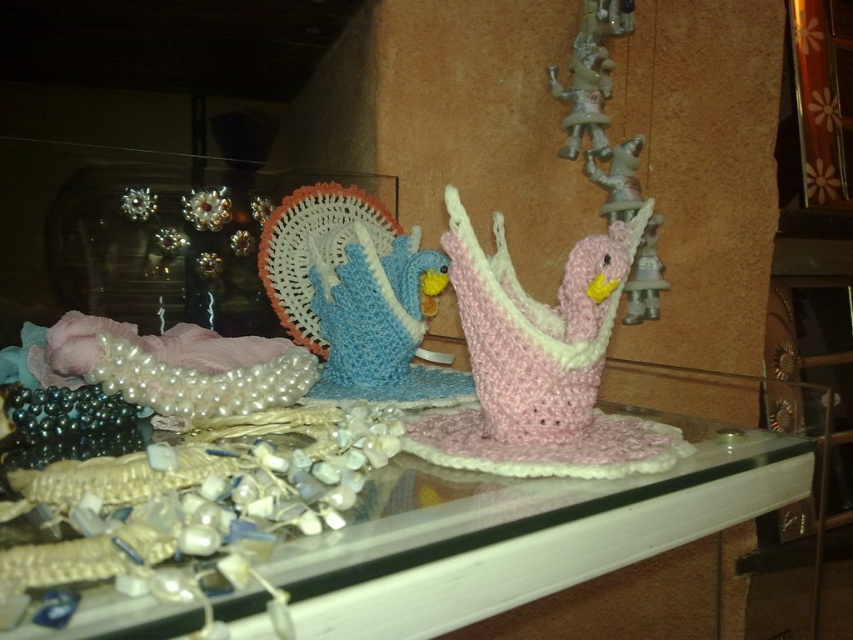
Which is behind, point (537, 445) or point (276, 278)?

The point (276, 278) is more distant.

Is point (462, 253) less distant than point (445, 273)?

Yes, it is in front of point (445, 273).

Identify the location of pink yarn duck at center. (540, 364).

Can you confirm if translucent glass table at center is positioned below pink yarn duck at center?

Yes, translucent glass table at center is below pink yarn duck at center.

Does point (660, 413) lie behind point (527, 310)?

That is True.

Measure the distance between translucent glass table at center and camera.

12.26 inches

The width and height of the screenshot is (853, 640). Identify the location of translucent glass table at center. (543, 516).

Can you confirm if translucent glass table at center is positioned above crochet blue bird at center?

No, translucent glass table at center is not above crochet blue bird at center.

Does point (223, 612) come in front of point (286, 221)?

Yes.

Image resolution: width=853 pixels, height=640 pixels. Find the location of `translucent glass table at center`. translucent glass table at center is located at coordinates (543, 516).